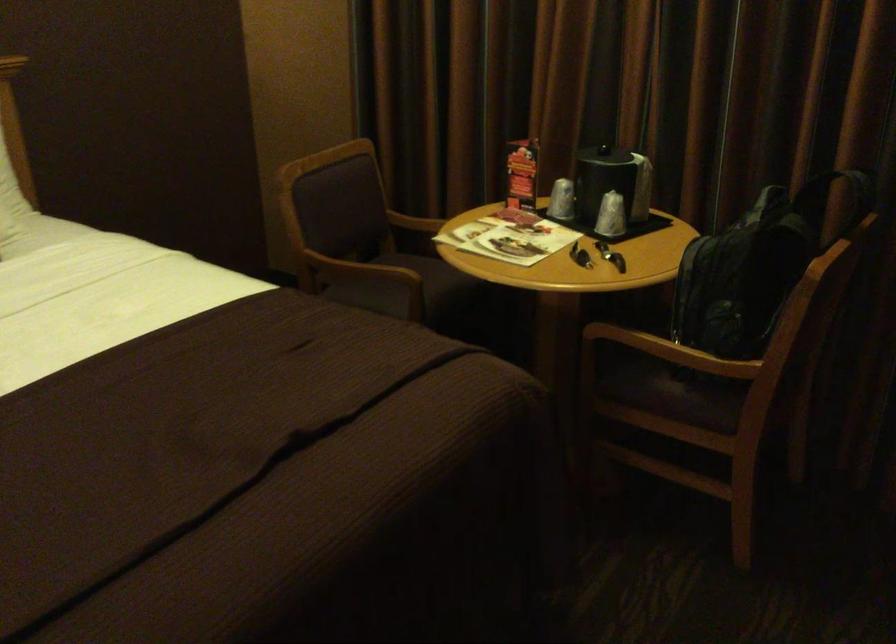
Where is `chair sitting surface`? The width and height of the screenshot is (896, 644). chair sitting surface is located at coordinates tap(440, 279).